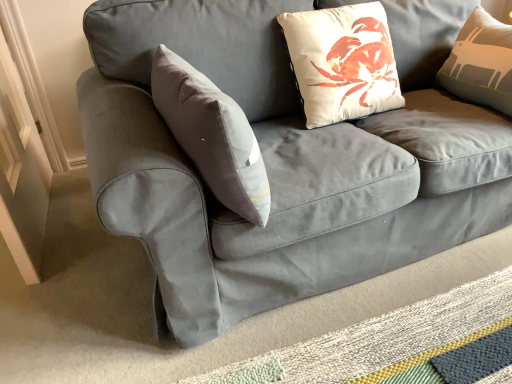
Question: From a real-world perspective, is white matte pillow at upper center physically located above or below textured woven mat at lower right?

Choices:
 (A) above
 (B) below

Answer: (A)

Question: Would you say white matte pillow at upper center is inside or outside textured woven mat at lower right?

Choices:
 (A) inside
 (B) outside

Answer: (B)

Question: Is white matte pillow at upper center taller or shorter than textured woven mat at lower right?

Choices:
 (A) short
 (B) tall

Answer: (B)

Question: From a real-world perspective, is textured woven mat at lower right positioned above or below white matte pillow at upper center?

Choices:
 (A) below
 (B) above

Answer: (A)

Question: Considering the relative positions of textured woven mat at lower right and white matte pillow at upper center in the image provided, is textured woven mat at lower right to the left or to the right of white matte pillow at upper center?

Choices:
 (A) left
 (B) right

Answer: (B)

Question: From the image's perspective, is textured woven mat at lower right located above or below white matte pillow at upper center?

Choices:
 (A) above
 (B) below

Answer: (B)

Question: Considering the positions of textured woven mat at lower right and white matte pillow at upper center in the image, is textured woven mat at lower right wider or thinner than white matte pillow at upper center?

Choices:
 (A) wide
 (B) thin

Answer: (A)